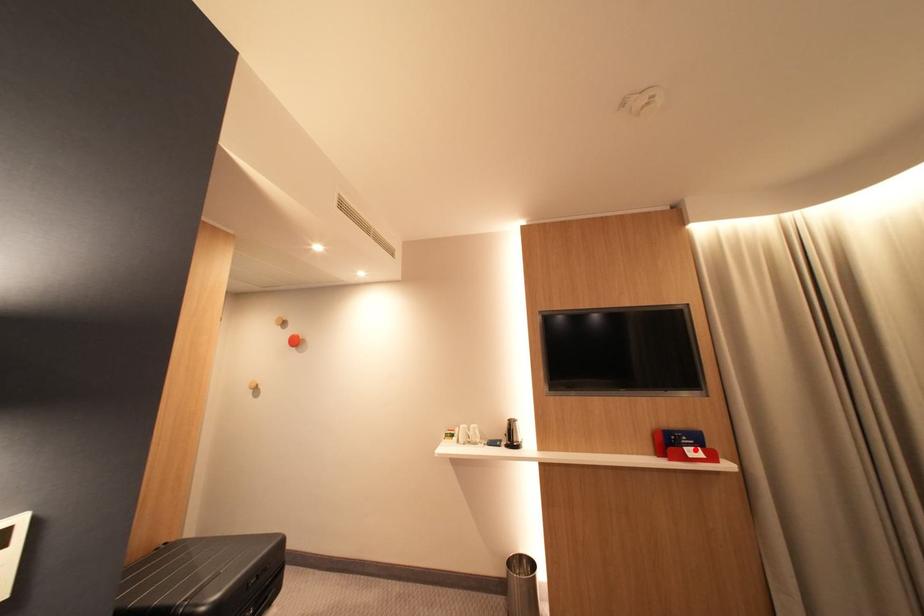
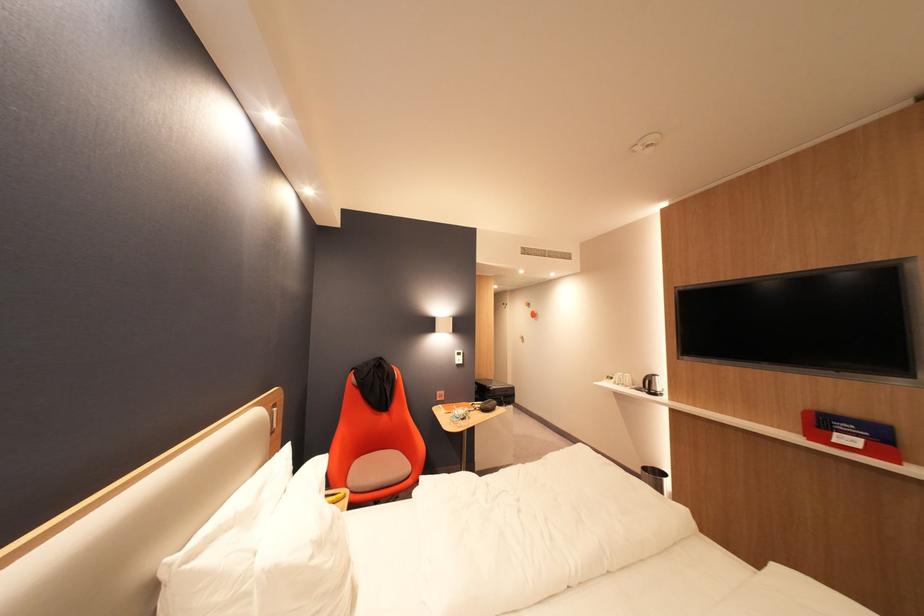
In the second image, find the point that corresponds to the highlighted location in the first image.

(846, 435)